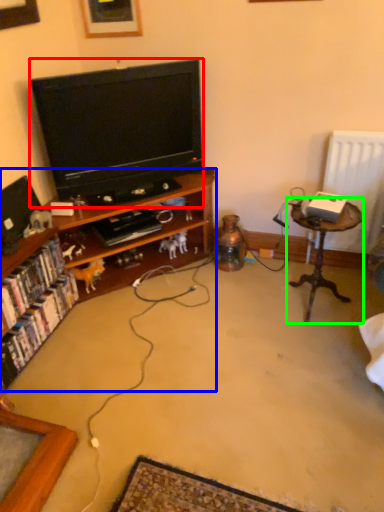
Question: Estimate the real-world distances between objects in this image. Which object is farther from television (highlighted by a red box), cabinetry (highlighted by a blue box) or table (highlighted by a green box)?

Choices:
 (A) cabinetry
 (B) table

Answer: (B)